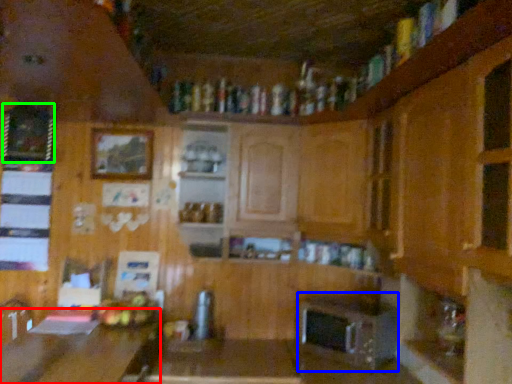
Question: Which is farther away from table (highlighted by a red box)? appliance (highlighted by a blue box) or picture frame (highlighted by a green box)?

Choices:
 (A) appliance
 (B) picture frame

Answer: (B)